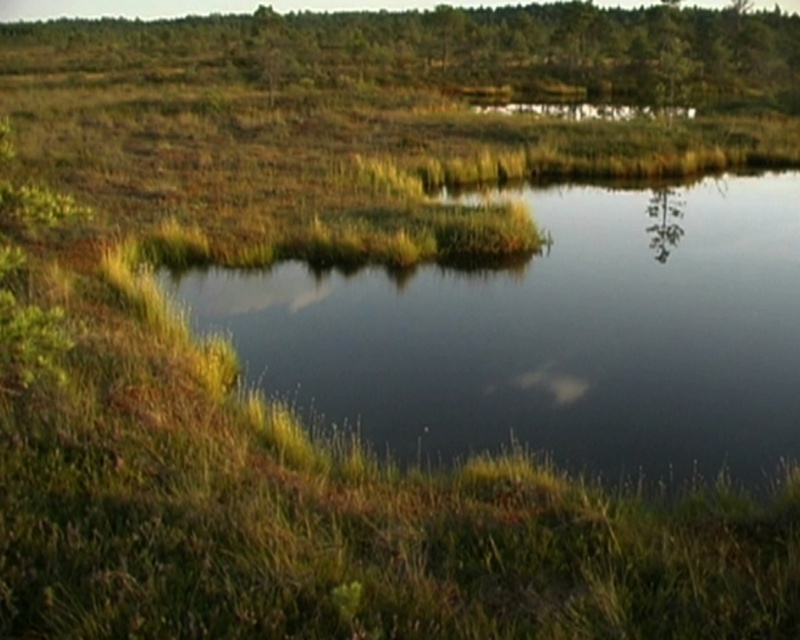
You are standing at the edge of the green grassy lake at center and want to look up at the green matte tree at upper center. Which direction should you look?

You should look upward because the green matte tree at upper center is positioned above the green grassy lake at center.

You are a bird flying over the wetland and want to land on the closest vegetation. Which one is lower between the green grassy lake at center and the green matte tree at upper center?

The green grassy lake at center is not as tall as the green matte tree at upper center, so the green grassy lake at center is lower and closer to the ground. Therefore, the bird should land on the green grassy lake at center.